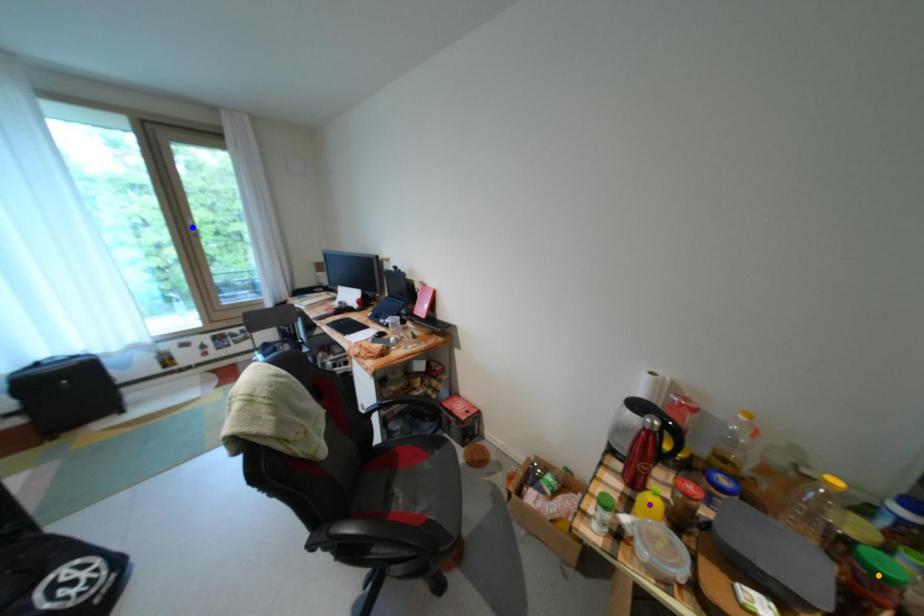
Order these from nearest to farthest:
orange point | blue point | purple point

blue point, purple point, orange point